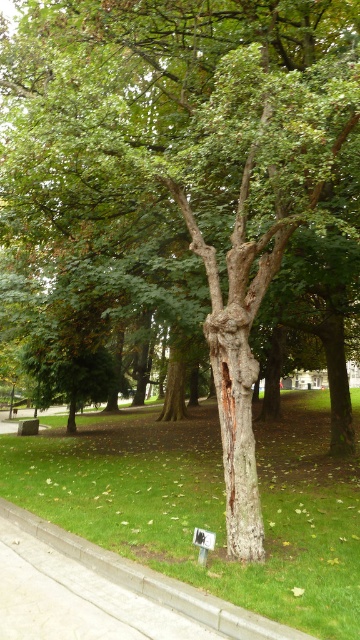
Identify the location of green grass at center. (206, 504).

Describe the element at coordinates (206, 504) in the screenshot. The image size is (360, 640). I see `green grass at center` at that location.

Locate an element on the screen. green grass at center is located at coordinates (206, 504).